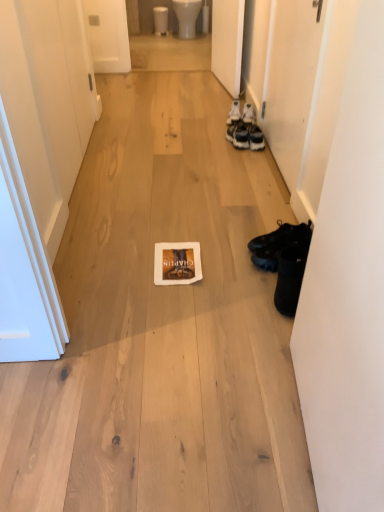
I want to click on free location in front of white matte door at upper right, marked as the 2th door in a left-to-right arrangement, so click(200, 96).